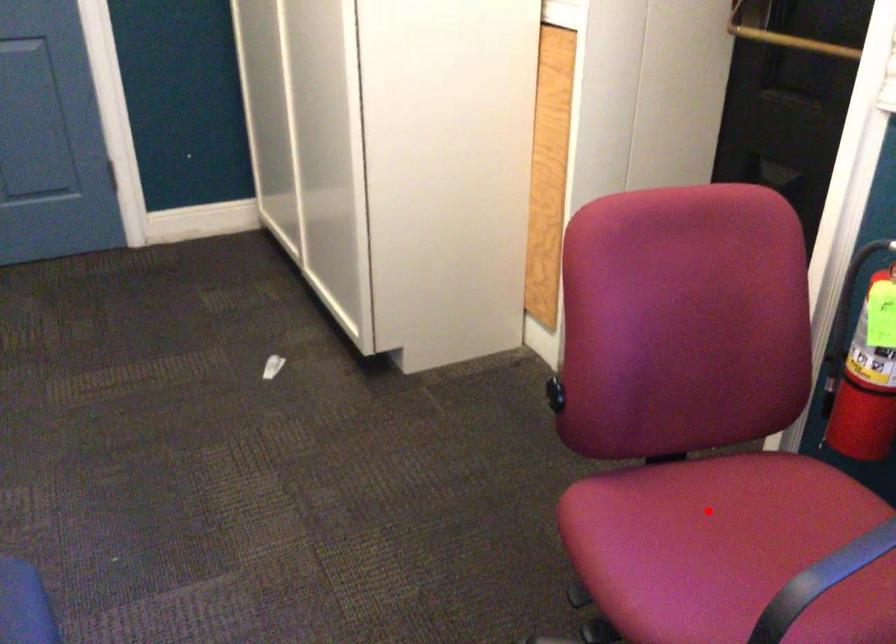
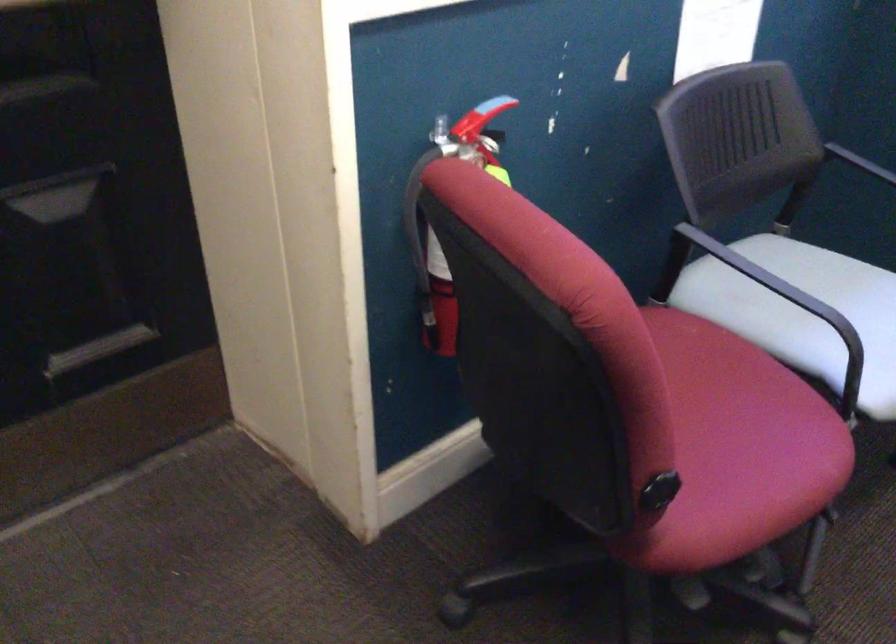
Question: I am providing you with two images of the same scene from different viewpoints. A red point is marked on the first image. Is the red point's position out of view in image 2?

Choices:
 (A) Yes
 (B) No

Answer: (A)